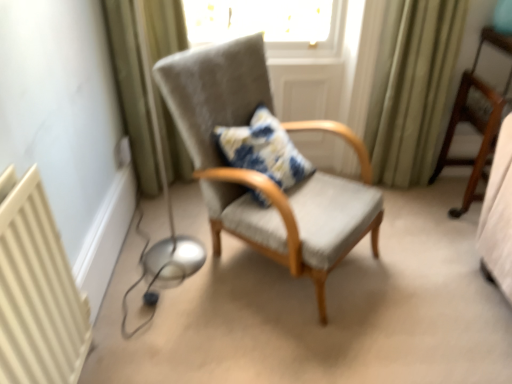
Question: Considering the relative sizes of green fabric curtain at left, arranged as the 1th curtain when viewed from the left, and textured gray armchair at center, marked as the 1th chair in a left-to-right arrangement, in the image provided, is green fabric curtain at left, arranged as the 1th curtain when viewed from the left, thinner than textured gray armchair at center, marked as the 1th chair in a left-to-right arrangement,?

Choices:
 (A) no
 (B) yes

Answer: (B)

Question: Is green fabric curtain at left, arranged as the 1th curtain when viewed from the left, not inside textured gray armchair at center, the second chair viewed from the right?

Choices:
 (A) yes
 (B) no

Answer: (A)

Question: Does green fabric curtain at left, which ranks as the 2th curtain in right-to-left order, come behind textured gray armchair at center, marked as the 1th chair in a left-to-right arrangement?

Choices:
 (A) yes
 (B) no

Answer: (A)

Question: Does green fabric curtain at left, which ranks as the 2th curtain in right-to-left order, have a greater height compared to textured gray armchair at center, the second chair viewed from the right?

Choices:
 (A) yes
 (B) no

Answer: (A)

Question: Considering the relative sizes of green fabric curtain at left, arranged as the 1th curtain when viewed from the left, and textured gray armchair at center, marked as the 1th chair in a left-to-right arrangement, in the image provided, is green fabric curtain at left, arranged as the 1th curtain when viewed from the left, shorter than textured gray armchair at center, marked as the 1th chair in a left-to-right arrangement,?

Choices:
 (A) no
 (B) yes

Answer: (A)

Question: Considering the relative sizes of green fabric curtain at left, arranged as the 1th curtain when viewed from the left, and textured gray armchair at center, the second chair viewed from the right, in the image provided, is green fabric curtain at left, arranged as the 1th curtain when viewed from the left, wider than textured gray armchair at center, the second chair viewed from the right,?

Choices:
 (A) no
 (B) yes

Answer: (A)

Question: From a real-world perspective, does green fabric curtain at left, which ranks as the 2th curtain in right-to-left order, sit lower than blue and white tie-dye pillow at center?

Choices:
 (A) yes
 (B) no

Answer: (B)

Question: From the image's perspective, would you say green fabric curtain at left, which ranks as the 2th curtain in right-to-left order, is positioned over blue and white tie-dye pillow at center?

Choices:
 (A) no
 (B) yes

Answer: (B)

Question: Considering the relative sizes of green fabric curtain at left, which ranks as the 2th curtain in right-to-left order, and blue and white tie-dye pillow at center in the image provided, is green fabric curtain at left, which ranks as the 2th curtain in right-to-left order, shorter than blue and white tie-dye pillow at center?

Choices:
 (A) no
 (B) yes

Answer: (A)

Question: Is green fabric curtain at left, arranged as the 1th curtain when viewed from the left, looking in the opposite direction of blue and white tie-dye pillow at center?

Choices:
 (A) no
 (B) yes

Answer: (A)

Question: Is green fabric curtain at left, arranged as the 1th curtain when viewed from the left, placed right next to blue and white tie-dye pillow at center?

Choices:
 (A) yes
 (B) no

Answer: (B)

Question: From a real-world perspective, is green fabric curtain at left, which ranks as the 2th curtain in right-to-left order, physically above blue and white tie-dye pillow at center?

Choices:
 (A) yes
 (B) no

Answer: (A)

Question: Is green fabric curtain at left, arranged as the 1th curtain when viewed from the left, looking in the opposite direction of white plastic electric outlet at lower left?

Choices:
 (A) no
 (B) yes

Answer: (A)